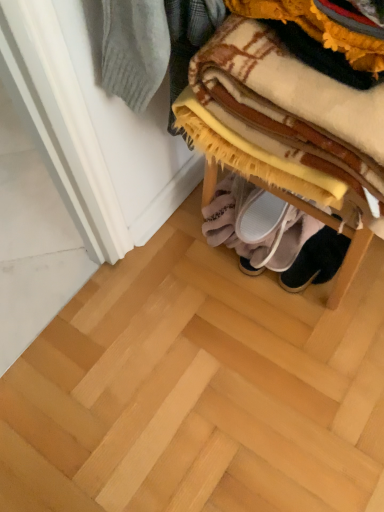
At what (x,y) coordinates should I click in order to perform the action: click on free location in front of white fabric slipper at lower center, positioned as the 1th footwear in left-to-right order. Please return your answer as a coordinate pair (x, y). The image size is (384, 512). Looking at the image, I should click on (249, 300).